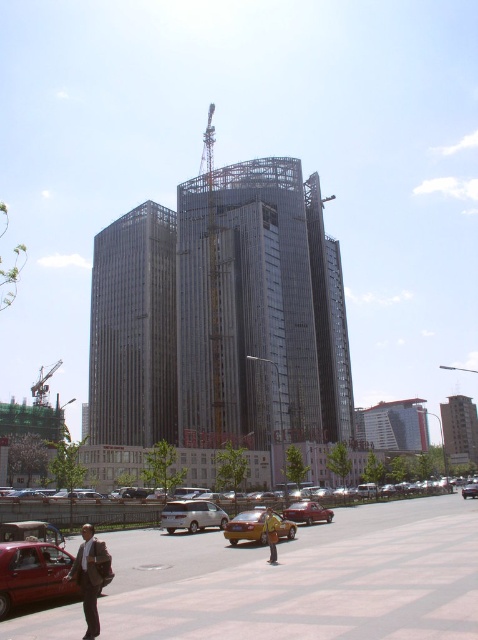
You are a pedestrian standing on the sidewalk and want to cross the road to reach the construction site. The yellow metallic taxi at lower left is blocking your path. Can you walk around it to get to the metallic scaffolding at center?

Yes, you can walk around the yellow metallic taxi at lower left because the metallic scaffolding at center is to the right of the taxi, so you can go around it on the right side.

You are a construction worker standing near the yellow metallic taxi at lower left. You need to reach the top of the metallic scaffolding at center to secure some materials. Considering the height difference between the two, is the scaffolding within your reach from the ground level where the taxi is parked?

The metallic scaffolding at center is much taller than the yellow metallic taxi at lower left, so the scaffolding extends far above the ground level where the taxi is parked. You would need to climb the scaffolding or use equipment like a ladder to reach the top from the ground.